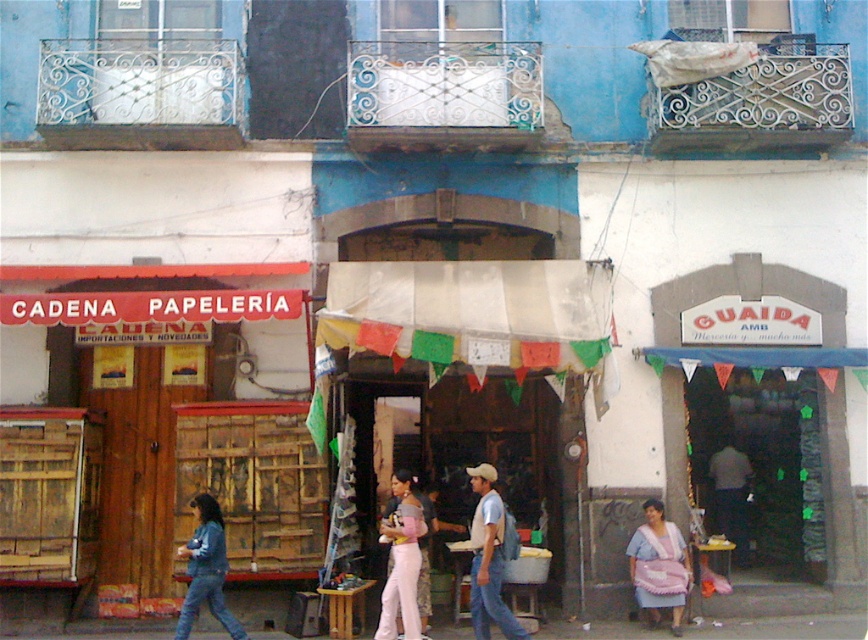
Question: Is pink fabric at lower right thinner than light pink fabric at center?

Choices:
 (A) yes
 (B) no

Answer: (B)

Question: Among these objects, which one is nearest to the camera?

Choices:
 (A) denim jacket at lower left
 (B) light blue denim jeans at center
 (C) light pink fabric at center
 (D) pink fabric at lower right

Answer: (B)

Question: Does light pink fabric at center appear under denim jacket at lower left?

Choices:
 (A) no
 (B) yes

Answer: (A)

Question: Based on their relative distances, which object is farther from the light blue denim jeans at center?

Choices:
 (A) denim jacket at lower left
 (B) light pink fabric at center

Answer: (A)

Question: Among these points, which one is nearest to the camera?

Choices:
 (A) (678, 602)
 (B) (478, 611)
 (C) (411, 493)
 (D) (214, 516)

Answer: (B)

Question: Does pink fabric at lower right appear under denim jacket at lower left?

Choices:
 (A) yes
 (B) no

Answer: (A)